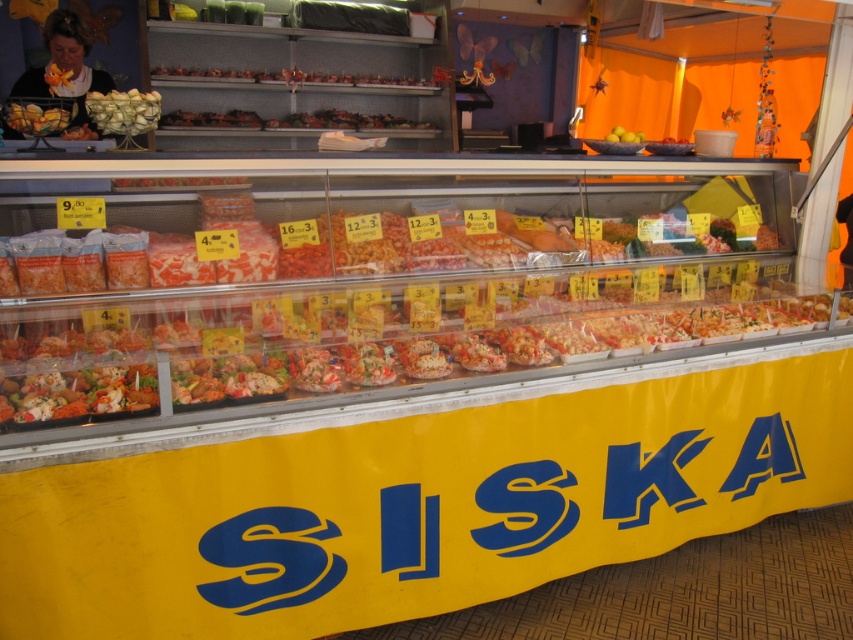
You are a customer at the food stall and want to buy both the shiny plastic salad at lower left and the yellow matte lemons at upper right. If you can reach items within 5 feet without moving, can you grab both items at the same time?

The shiny plastic salad at lower left and yellow matte lemons at upper right are 4.42 feet apart from each other, so yes, you can grab both items at the same time since the distance is within your 5 feet reach.

You are a customer at the food stall and want to pick up the matte yellow fruit at upper left and the translucent plastic bag at upper center. Which item should you reach for first to grab both efficiently?

You should reach for the matte yellow fruit at upper left first because it is closer to you than the translucent plastic bag at upper center, so you can grab it without moving your hand past the farther item.

You are a customer at the food stall and want to buy the matte yellow fruit at upper left and the translucent plastic bag at upper center. Which item is located to the right of the other?

The matte yellow fruit at upper left is positioned on the right side of the translucent plastic bag at upper center, so the matte yellow fruit at upper left is to the right of the translucent plastic bag at upper center.